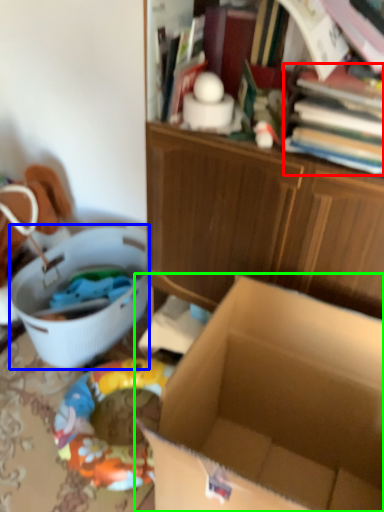
Question: Which is farther away from book (highlighted by a red box)? laundry basket (highlighted by a blue box) or box (highlighted by a green box)?

Choices:
 (A) laundry basket
 (B) box

Answer: (A)